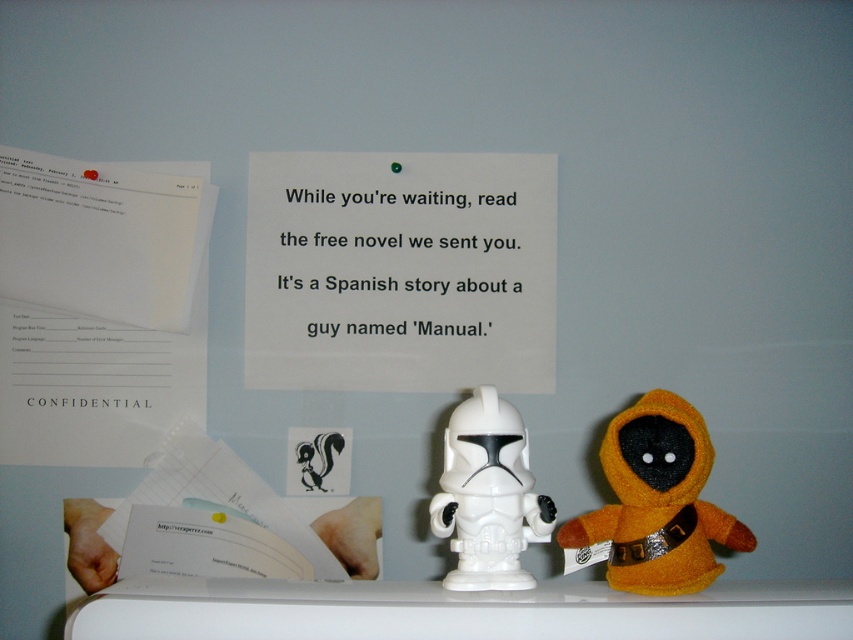
Between black paper at center and white plastic toy at center, which one has more height?

black paper at center

This screenshot has width=853, height=640. I want to click on black paper at center, so click(393, 260).

Is orange plush toy at center above white plastic toy at center?

Actually, orange plush toy at center is below white plastic toy at center.

Who is more distant from viewer, (633, 456) or (486, 451)?

The point (486, 451) is more distant.

This screenshot has width=853, height=640. Identify the location of orange plush toy at center. (657, 500).

Is black paper at center taller than orange plush toy at center?

Correct, black paper at center is much taller as orange plush toy at center.

Who is positioned more to the left, black paper at center or orange plush toy at center?

Positioned to the left is black paper at center.

Locate an element on the screen. black paper at center is located at coordinates (393, 260).